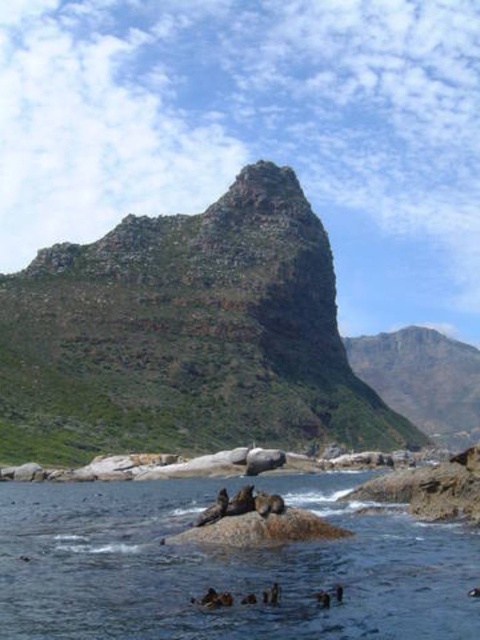
Question: Is brown textured water at center below green rocky mountain at center?

Choices:
 (A) no
 (B) yes

Answer: (A)

Question: Estimate the real-world distances between objects in this image. Which object is farther from the rugged rock mountain at center?

Choices:
 (A) brown textured water at center
 (B) green rocky mountain at center

Answer: (B)

Question: In this image, where is rugged rock mountain at center located relative to green rocky mountain at center?

Choices:
 (A) above
 (B) below

Answer: (A)

Question: Considering the real-world distances, which object is closest to the rugged rock mountain at center?

Choices:
 (A) brown textured water at center
 (B) green rocky mountain at center

Answer: (A)

Question: Can you confirm if rugged rock mountain at center is smaller than green rocky mountain at center?

Choices:
 (A) yes
 (B) no

Answer: (B)

Question: Among these objects, which one is nearest to the camera?

Choices:
 (A) rugged rock mountain at center
 (B) brown textured water at center
 (C) green rocky mountain at center

Answer: (B)